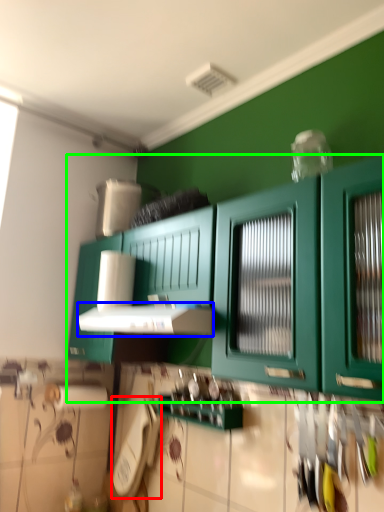
Question: Which object is the farthest from appliance (highlighted by a red box)? Choose among these: vent (highlighted by a blue box) or cabinetry (highlighted by a green box).

Choices:
 (A) vent
 (B) cabinetry

Answer: (B)